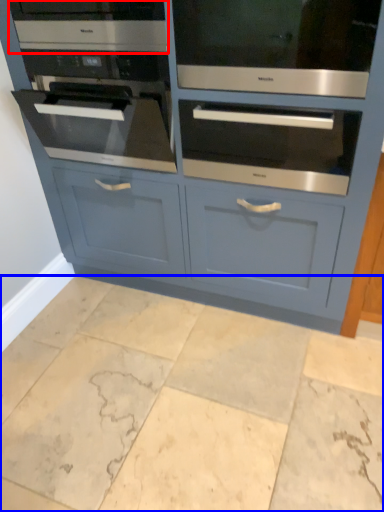
Question: Which object appears closest to the camera in this image, appliance (highlighted by a red box) or ceramic tile (highlighted by a blue box)?

Choices:
 (A) appliance
 (B) ceramic tile

Answer: (B)